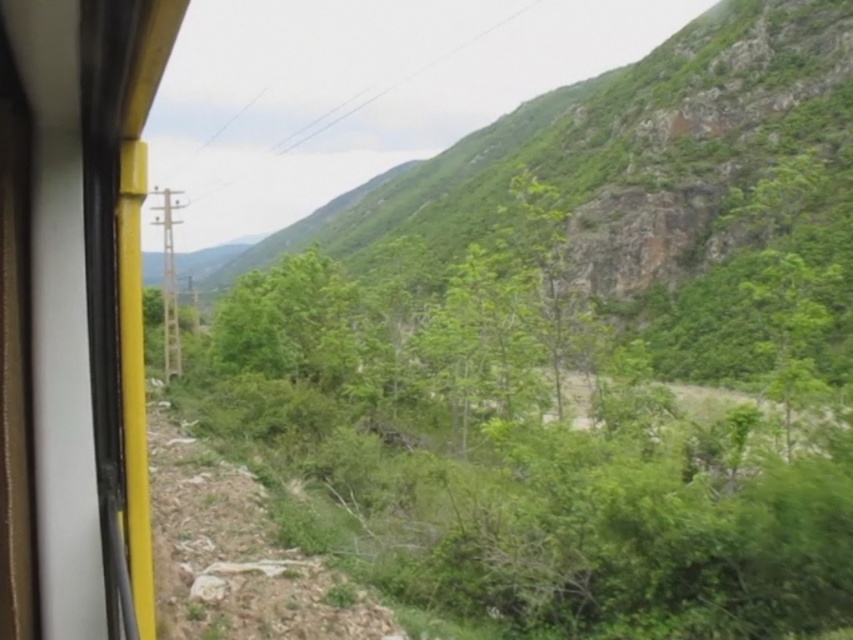
You are sitting inside the train and looking out the matte yellow train window at left. You notice the green leafy shrubs at center outside. Which object is closer to you, the observer?

The green leafy shrubs at center are closer to you than the matte yellow train window at left because they are positioned further to the viewer.

You are a botanist observing the vegetation from the train window. You notice both green leafy shrubs at center and green leafy hillside at center. Which of these two has a larger size?

The green leafy hillside at center is larger than the green leafy shrubs at center.

You are inside a train and looking out the window. You notice a point marked at coordinates (637,173). Based on the scene, what does this point indicate?

The point at (637,173) marks the green leafy hillside at center.